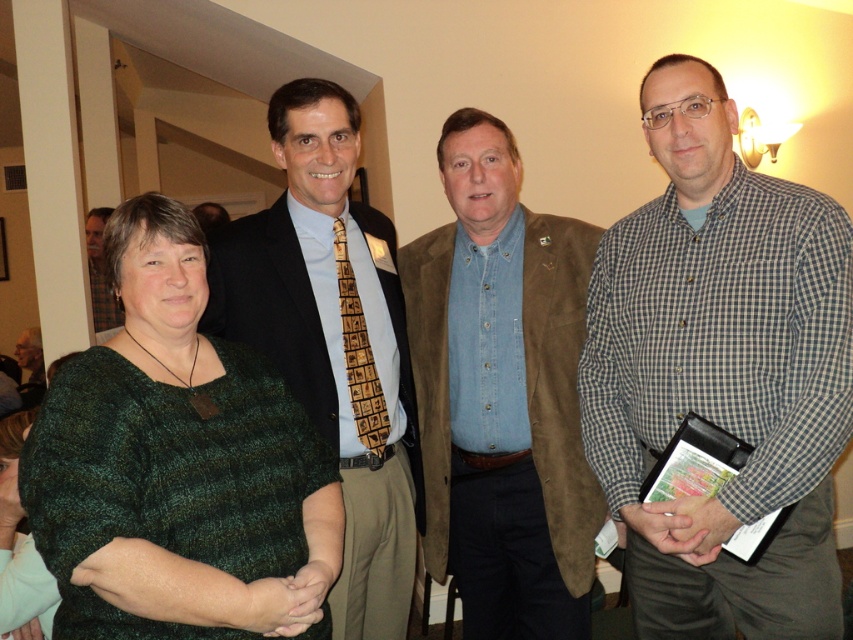
Consider the image. You are standing in the room and want to move from the point at coordinates point (354, 413) to the point at coordinates point (3, 545). Since you can only move forward, will you be moving towards or away from the camera?

Since point (354, 413) is further to the camera than point (3, 545), moving from point (354, 413) to point (3, 545) would mean moving away from the camera.

You are standing at the origin of the coordinate system in the scene. Which of the two points, point (444,492) or point (369,438), is farther away from you?

Point (444,492) is farther away from the origin than point (369,438) because it is behind point (369,438).

You are organizing a photo shoot and need to ensure that the denim shirt at center and the brown woven tie at center are visible in the frame. Given that the camera has a fixed focal length, which object should you prioritize positioning closer to the lens to ensure both are in focus?

The denim shirt at center should be positioned closer to the lens because its width surpasses that of the brown woven tie at center, ensuring both fit within the frame.